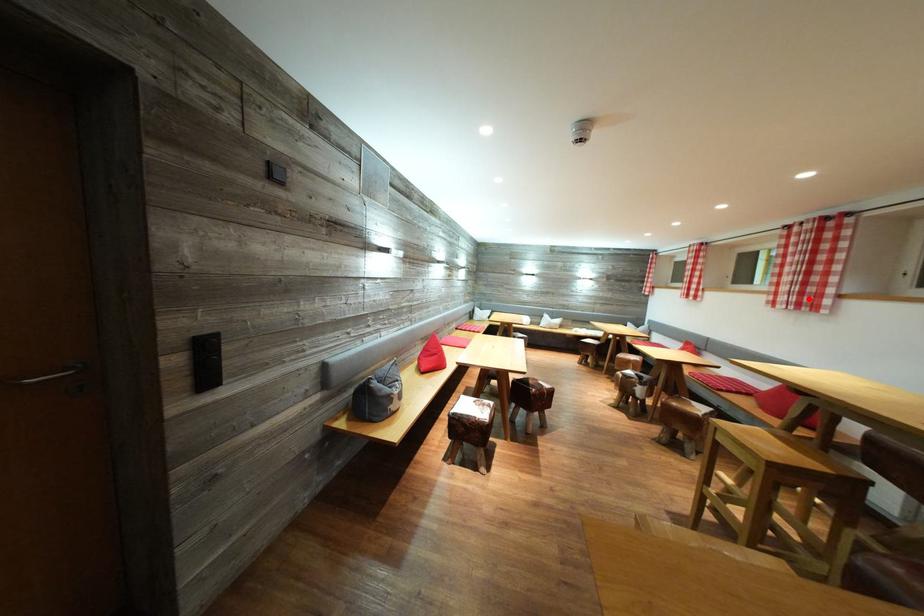
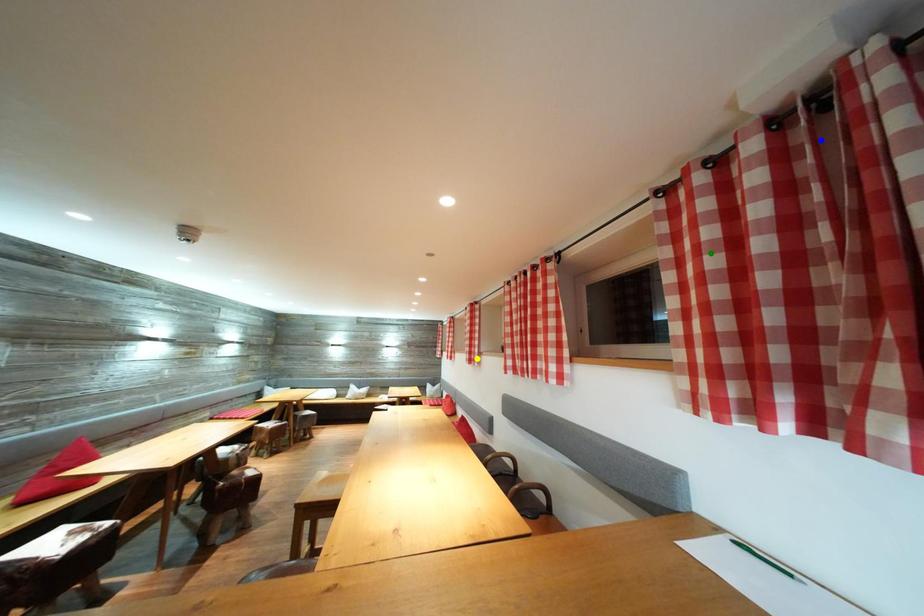
Question: I am providing you with two images of the same scene from different viewpoints. A red point is marked on the first image. You are given multiple points on the second image. Which point in image 2 is actually the same real-world point as the red point in image 1?

Choices:
 (A) blue point
 (B) yellow point
 (C) green point

Answer: (B)